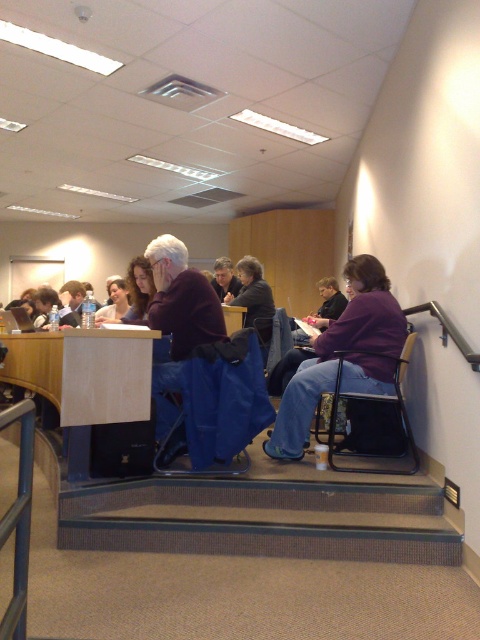
Question: Does light brown wood table at center have a greater width compared to wooden table at center?

Choices:
 (A) no
 (B) yes

Answer: (B)

Question: Which object is closer to the camera taking this photo?

Choices:
 (A) metallic black chair at lower right
 (B) blue fabric chair at center
 (C) purple fabric chair at lower right

Answer: (A)

Question: Which of the following is the farthest from the observer?

Choices:
 (A) (196, 360)
 (B) (369, 349)
 (C) (264, 365)

Answer: (B)

Question: Among these points, which one is farthest from the camera?

Choices:
 (A) (364, 364)
 (B) (39, 353)
 (C) (233, 333)

Answer: (B)

Question: Does blue fabric chair at lower center have a smaller size compared to wooden table at center?

Choices:
 (A) yes
 (B) no

Answer: (B)

Question: Is purple fabric chair at lower right above metallic black chair at lower right?

Choices:
 (A) yes
 (B) no

Answer: (A)